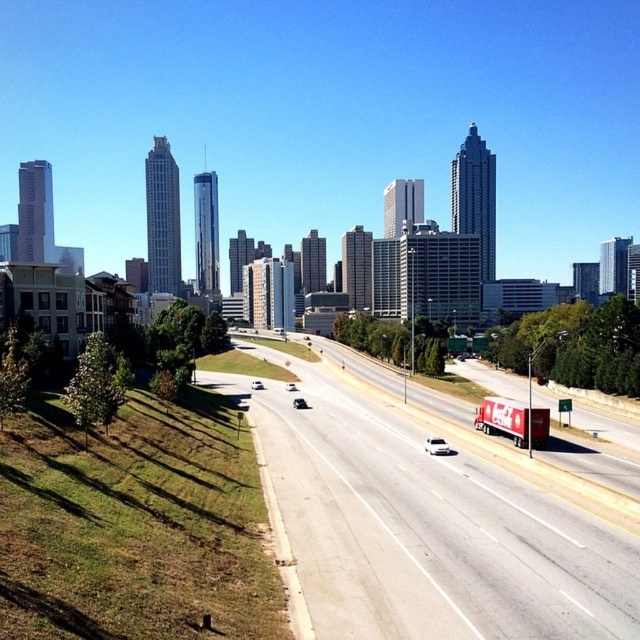
Question: Which point is farther to the camera?

Choices:
 (A) white matte truck at center-right
 (B) white asphalt highway at center

Answer: (A)

Question: Does white asphalt highway at center appear on the left side of white glossy car at center?

Choices:
 (A) yes
 (B) no

Answer: (B)

Question: Which object appears farthest from the camera in this image?

Choices:
 (A) shiny silver sedan at center
 (B) white matte truck at center-right
 (C) white asphalt highway at center
 (D) white glossy car at center

Answer: (D)

Question: Does white asphalt highway at center have a larger size compared to white matte truck at center-right?

Choices:
 (A) yes
 (B) no

Answer: (A)

Question: Does white matte truck at center-right come behind white matte car at center?

Choices:
 (A) no
 (B) yes

Answer: (A)

Question: Which point is farther to the camera?

Choices:
 (A) (440, 520)
 (B) (424, 444)
 (C) (301, 401)

Answer: (C)